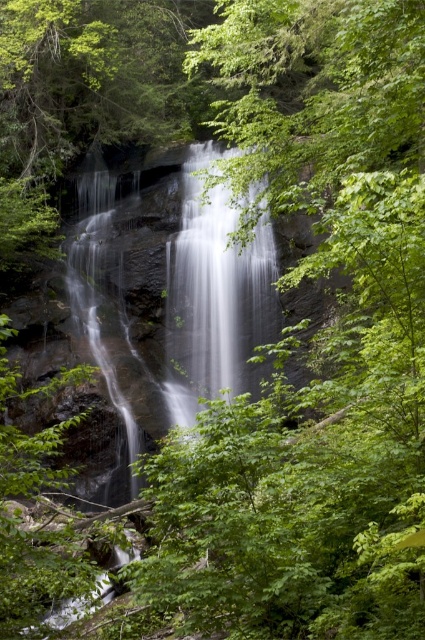
You are standing at the base of the waterfall and want to locate two specific points in the image. The first point is at coordinates point (x=127, y=340), and the second is at point (x=184, y=324). Which of these two points is closer to you?

Point (x=127, y=340) is in front of point (x=184, y=324), so it is closer to you.

Consider the image. You are a photographer standing at the edge of a forest path, aiming to capture the smooth gray rock waterfall at center. Given that your camera requires a minimum distance of 15 meters for optimal focus, will you be able to take a clear photo from your current position?

The smooth gray rock waterfall at center is 17.69 meters away from camera, which is beyond the 15 meters minimum required for optimal focus. Therefore, you can take a clear photo from your current position.

You are a photographer planning to capture the waterfall scene. You want to ensure your camera can fully capture the width of both the smooth gray rock waterfall at center and the white smooth waterfall at center. Given that your camera sensor can only capture up to 1.5 meters in width, which waterfall should you prioritize to fit within the frame?

The smooth gray rock waterfall at center has a greater width than the white smooth waterfall at center. Since the camera sensor can only capture up to 1.5 meters, you should prioritize photographing the white smooth waterfall at center to ensure it fits within the frame.